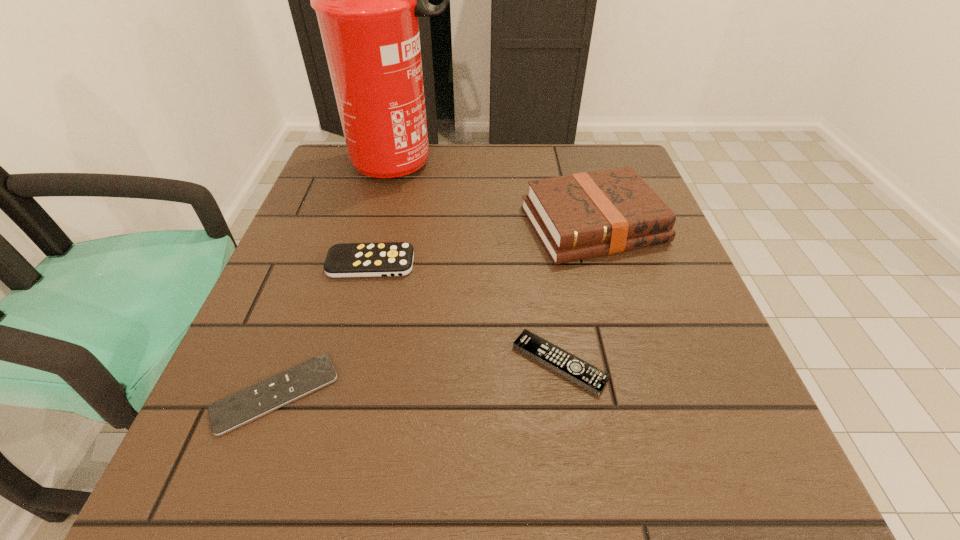
Find the location of a particular element. The image size is (960, 540). vacant space at the near edge of the desktop is located at coordinates (386, 470).

Find the location of a particular element. The height and width of the screenshot is (540, 960). vacant region at the left edge of the desktop is located at coordinates (297, 410).

The width and height of the screenshot is (960, 540). In order to click on free space at the right edge of the desktop in this screenshot , I will do `click(689, 384)`.

The image size is (960, 540). I want to click on vacant space at the far left corner, so click(x=347, y=168).

Identify the location of free space at the near left corner. (236, 447).

Find the location of a particular element. The height and width of the screenshot is (540, 960). vacant area between the tallest object and the fourth tallest object is located at coordinates (481, 264).

Where is `vacant area between the hardback book and the farthest object`? Image resolution: width=960 pixels, height=540 pixels. vacant area between the hardback book and the farthest object is located at coordinates (498, 194).

You are a GUI agent. You are given a task and a screenshot of the screen. Output one action in this format:
    pyautogui.click(x=<x>, y=<y>)
    Task: Click on the vacant area between the farthest remote control and the farthest object
    This screenshot has height=540, width=960.
    Given the screenshot: What is the action you would take?
    pyautogui.click(x=387, y=214)

Where is `unoccupied position between the second tallest object and the shortest object`? This screenshot has height=540, width=960. unoccupied position between the second tallest object and the shortest object is located at coordinates (435, 309).

Locate an element on the screen. vacant area that lies between the fire extinguisher and the rightmost remote control is located at coordinates (481, 264).